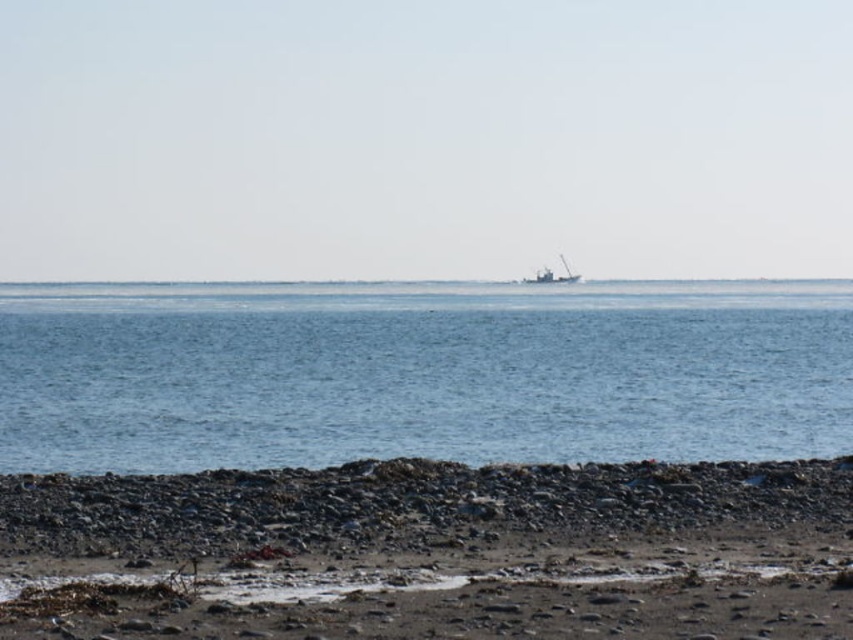
Between point (404, 460) and point (573, 275), which one is positioned in front?

Point (404, 460) is in front.

Can you confirm if smooth pebbles at lower center is taller than metallic gray boat at center?

In fact, smooth pebbles at lower center may be shorter than metallic gray boat at center.

The width and height of the screenshot is (853, 640). I want to click on smooth pebbles at lower center, so click(432, 552).

Describe the element at coordinates (421, 372) in the screenshot. This screenshot has height=640, width=853. I see `blue water at center` at that location.

Is blue water at center to the left of metallic gray boat at center from the viewer's perspective?

Yes, blue water at center is to the left of metallic gray boat at center.

The height and width of the screenshot is (640, 853). Identify the location of blue water at center. (421, 372).

At what (x,y) coordinates should I click in order to perform the action: click on blue water at center. Please return your answer as a coordinate pair (x, y). Image resolution: width=853 pixels, height=640 pixels. Looking at the image, I should click on (421, 372).

Is point (294, 432) farther from camera compared to point (3, 577)?

Yes, point (294, 432) is behind point (3, 577).

Does point (236, 387) come in front of point (840, 520)?

That is False.

This screenshot has height=640, width=853. Identify the location of blue water at center. (421, 372).